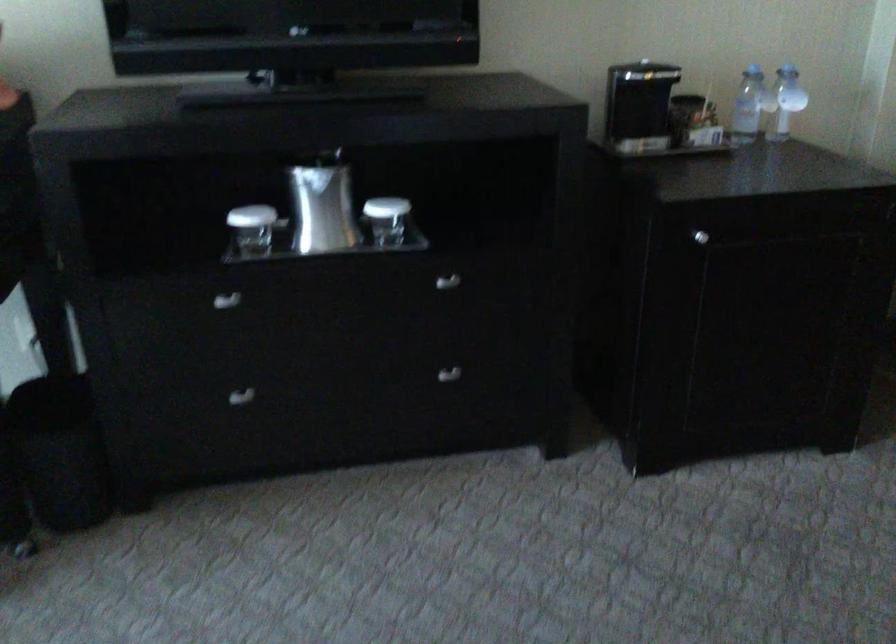
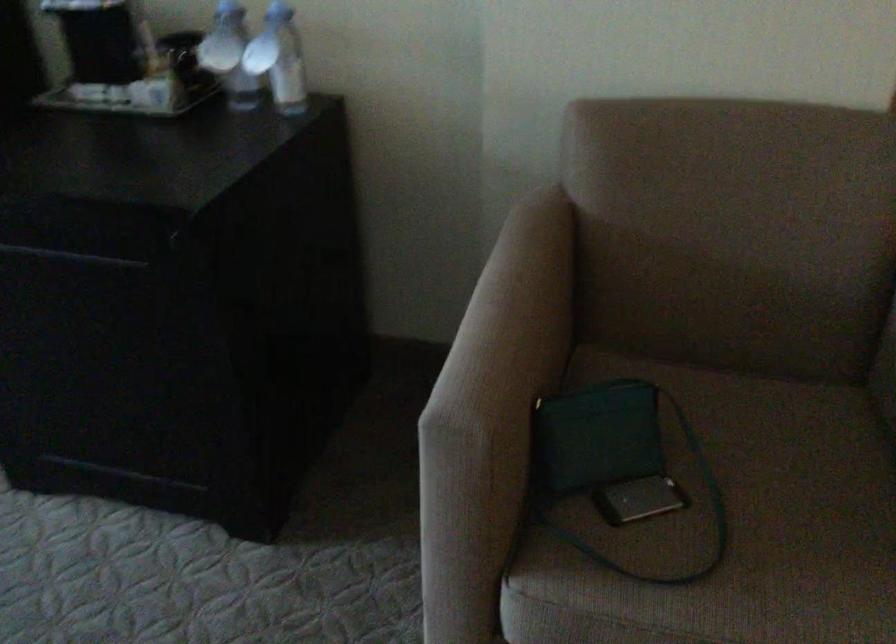
The point at (789, 90) is marked in the first image. Where is the corresponding point in the second image?

(279, 59)